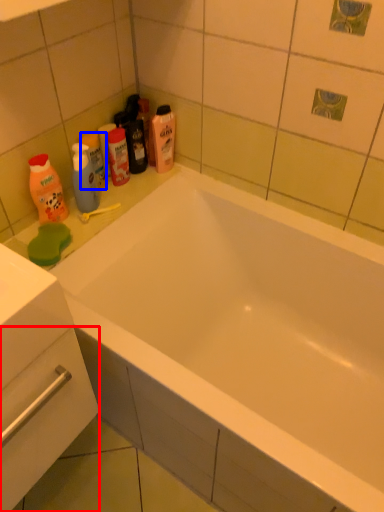
Question: Which object appears closest to the camera in this image, drawer (highlighted by a red box) or mouthwash (highlighted by a blue box)?

Choices:
 (A) drawer
 (B) mouthwash

Answer: (A)